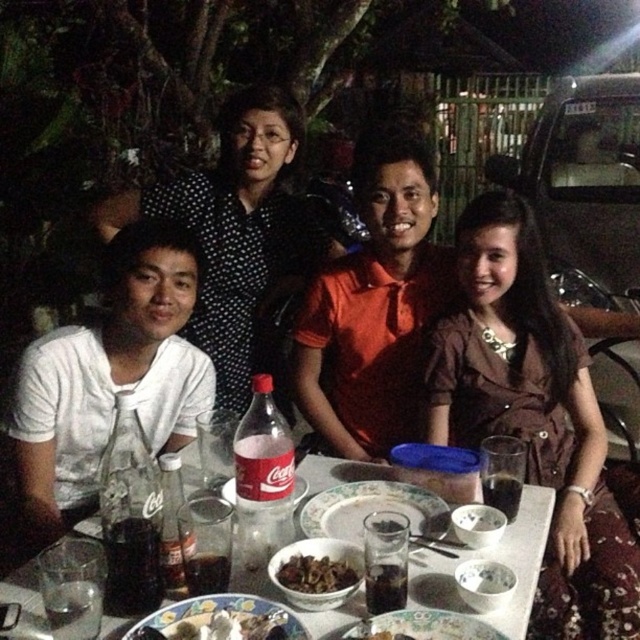
You are a photographer setting up a shot of the group. You want to ensure the black dotted shirt at upper center and the white matte rice bowl at center are both visible in the frame. Based on their positions, which object should you focus on first to capture both in the same shot?

The black dotted shirt at upper center is above the white matte rice bowl at center, so focusing on the shirt first will allow both to be captured in the frame since the shirt is higher up.